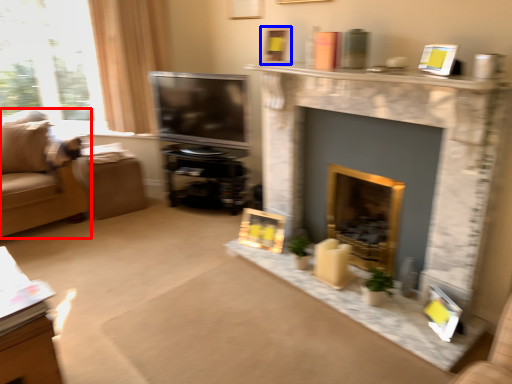
Question: Which object is closer to the camera taking this photo, studio couch (highlighted by a red box) or picture frame (highlighted by a blue box)?

Choices:
 (A) studio couch
 (B) picture frame

Answer: (B)